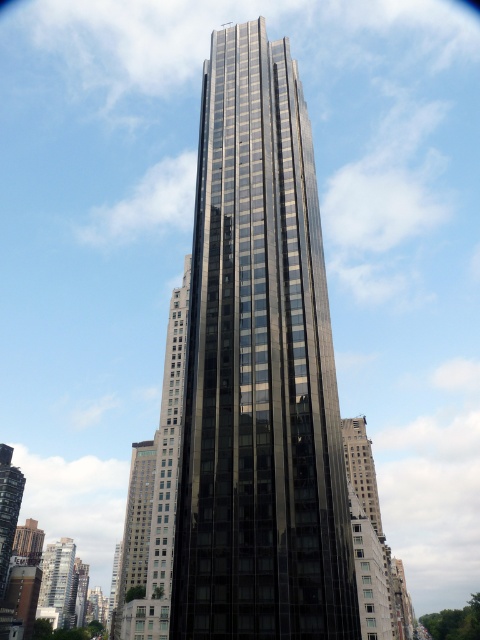
Question: Among these objects, which one is farthest from the camera?

Choices:
 (A) shiny glass skyscraper at lower left
 (B) glossy glass tower at center
 (C) glassy reflective building at center

Answer: (A)

Question: Can you confirm if shiny glass skyscraper at center is thinner than glassy reflective building at lower left?

Choices:
 (A) no
 (B) yes

Answer: (A)

Question: Estimate the real-world distances between objects in this image. Which object is farther from the glassy reflective building at lower left?

Choices:
 (A) glassy reflective building at center
 (B) glossy glass tower at center
 (C) shiny glass skyscraper at center
 (D) shiny glass skyscraper at lower left

Answer: (B)

Question: Is shiny glass skyscraper at center below glassy reflective building at center?

Choices:
 (A) no
 (B) yes

Answer: (B)

Question: Which object is positioned farthest from the shiny glass skyscraper at lower left?

Choices:
 (A) glassy reflective building at center
 (B) glossy glass tower at center
 (C) glassy reflective building at lower left
 (D) shiny glass skyscraper at center

Answer: (B)

Question: Can you confirm if glossy glass tower at center is bigger than shiny glass skyscraper at lower left?

Choices:
 (A) yes
 (B) no

Answer: (A)